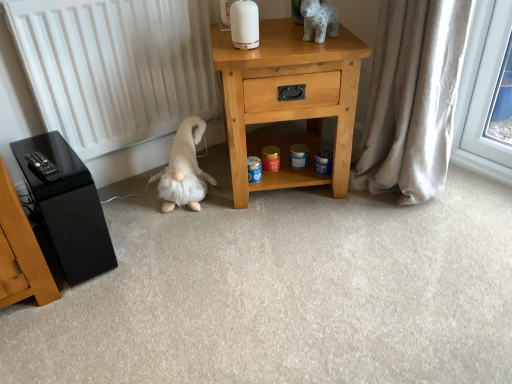
This screenshot has width=512, height=384. What are the coordinates of `vacant space underneath white matte radiator at left (from a real-world perspective)` in the screenshot? It's located at (145, 171).